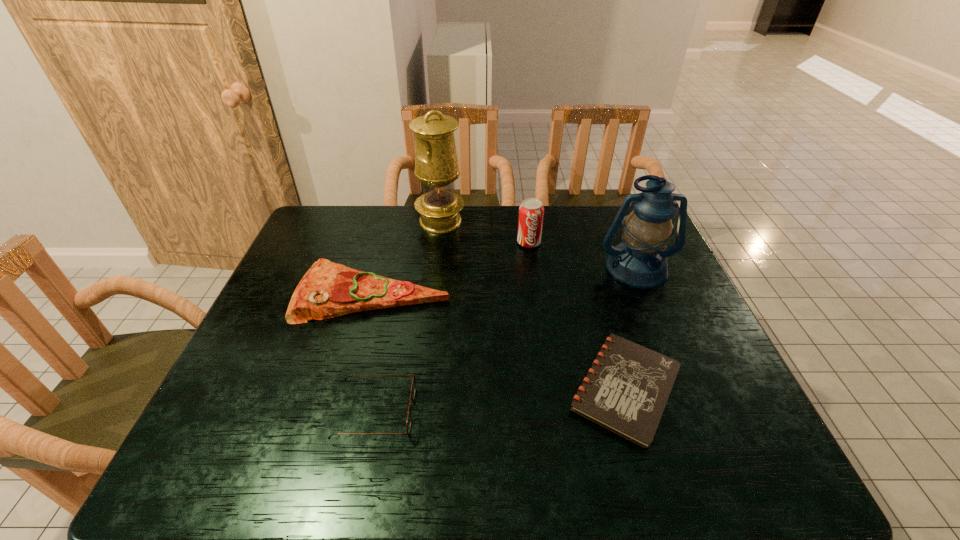
The height and width of the screenshot is (540, 960). I want to click on oil lamp, so click(436, 165).

In order to click on the fifth shortest object in this screenshot , I will do `click(640, 260)`.

Image resolution: width=960 pixels, height=540 pixels. I want to click on the third tallest object, so click(531, 212).

You are a GUI agent. You are given a task and a screenshot of the screen. Output one action in this format:
    pyautogui.click(x=<x>, y=<y>)
    Task: Click on the pizza
    
    Given the screenshot: What is the action you would take?
    pyautogui.click(x=327, y=290)

Where is `sunglasses`? The height and width of the screenshot is (540, 960). sunglasses is located at coordinates (413, 387).

At what (x,y) coordinates should I click in order to perform the action: click on the shortest object. Please return your answer as a coordinate pair (x, y). This screenshot has height=540, width=960. Looking at the image, I should click on coord(626,390).

What are the coordinates of `vacant space located on the right of the tallest object` in the screenshot? It's located at (543, 221).

You are a GUI agent. You are given a task and a screenshot of the screen. Output one action in this format:
    pyautogui.click(x=<x>, y=<y>)
    Task: Click on the vacant space situated 0.350m on the face of the second tallest object
    This screenshot has height=540, width=960.
    Given the screenshot: What is the action you would take?
    pyautogui.click(x=688, y=394)

The height and width of the screenshot is (540, 960). In order to click on vacant space situated on the logo side of the third tallest object in this screenshot , I will do `click(532, 266)`.

You are a GUI agent. You are given a task and a screenshot of the screen. Output one action in this format:
    pyautogui.click(x=<x>, y=<y>)
    Task: Click on the vacant point located on the right of the pizza
    This screenshot has height=540, width=960.
    Given the screenshot: What is the action you would take?
    pyautogui.click(x=535, y=294)